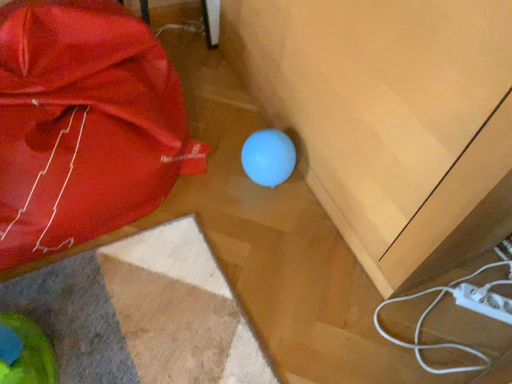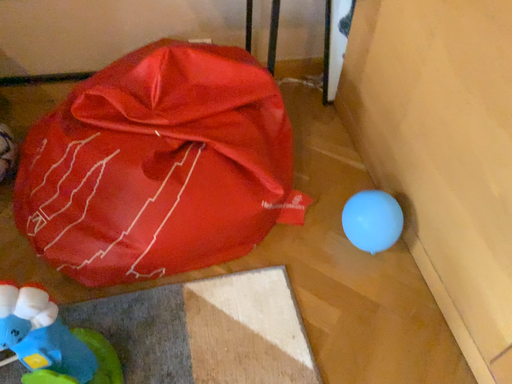
Question: Which way did the camera rotate in the video?

Choices:
 (A) rotated left
 (B) rotated right

Answer: (A)